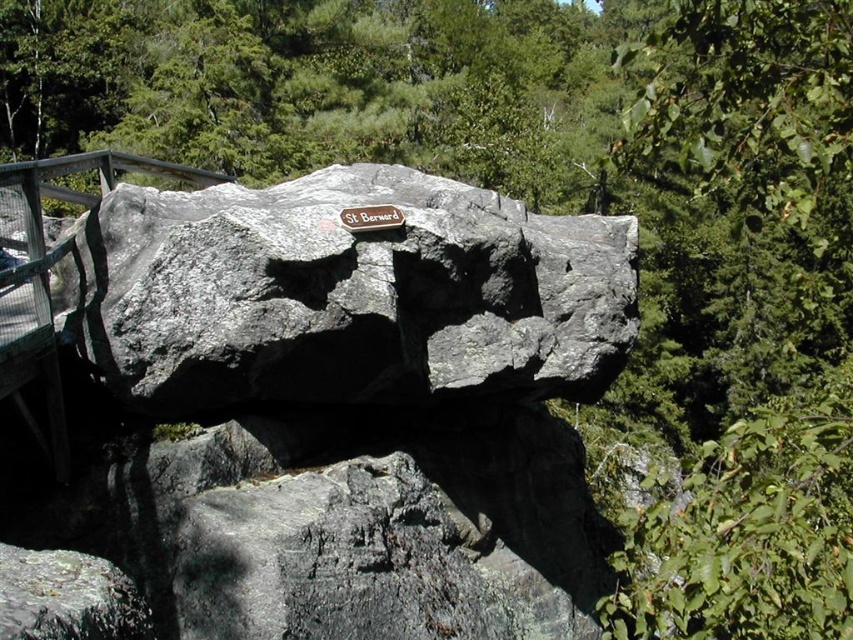
Question: Does gray rough rock at center come in front of metallic plaque at center?

Choices:
 (A) yes
 (B) no

Answer: (A)

Question: Is gray rough rock at center to the right of metallic plaque at center from the viewer's perspective?

Choices:
 (A) no
 (B) yes

Answer: (A)

Question: Does gray rough rock at center come behind metallic plaque at center?

Choices:
 (A) yes
 (B) no

Answer: (B)

Question: Which of the following is the closest to the observer?

Choices:
 (A) (374, 288)
 (B) (349, 212)

Answer: (A)

Question: Which object appears farthest from the camera in this image?

Choices:
 (A) metallic plaque at center
 (B) gray rough rock at center

Answer: (A)